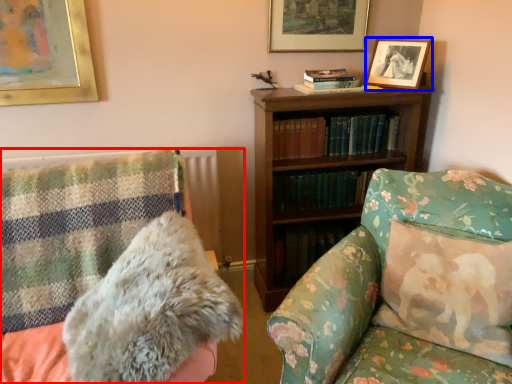
Question: Among these objects, which one is farthest to the camera, furniture (highlighted by a red box) or picture frame (highlighted by a blue box)?

Choices:
 (A) furniture
 (B) picture frame

Answer: (B)